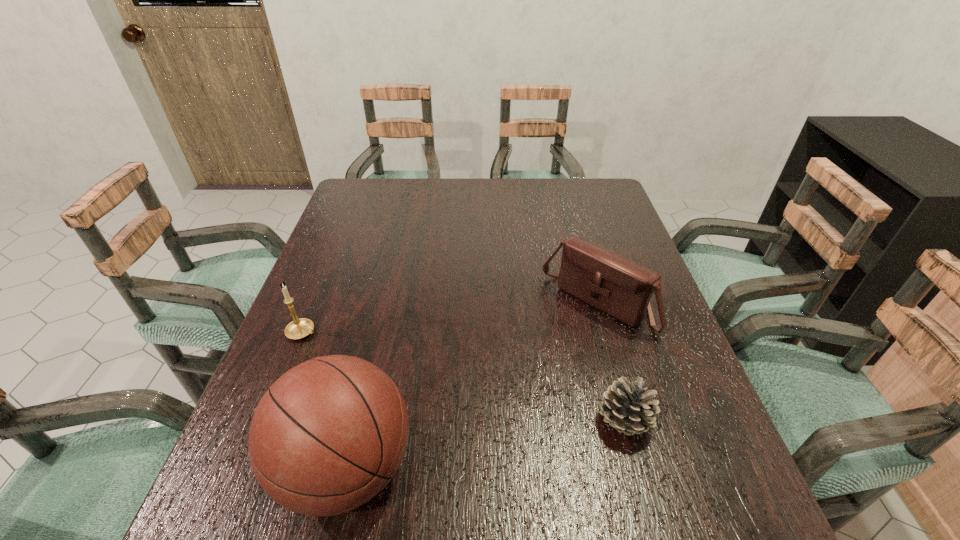
Locate an element on the screen. The width and height of the screenshot is (960, 540). vacant space on the desktop that is between the basketball and the pinecone and is positioned on the front flap of the shoulder bag is located at coordinates (467, 448).

The width and height of the screenshot is (960, 540). Find the location of `vacant spot on the desktop that is between the tallest object and the shortest object and is positioned on the handle side of the candle holder`. vacant spot on the desktop that is between the tallest object and the shortest object and is positioned on the handle side of the candle holder is located at coordinates (532, 437).